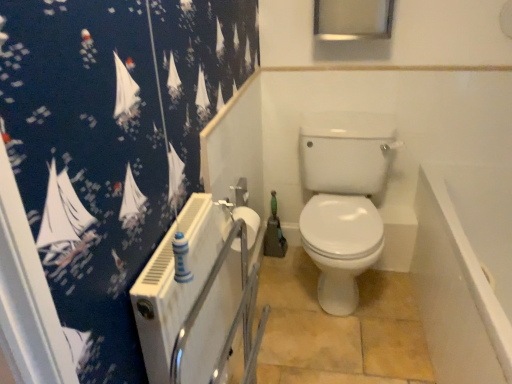
Question: Does white glossy bathtub at lower right appear on the right side of white matte toilet paper at center?

Choices:
 (A) no
 (B) yes

Answer: (B)

Question: Is white glossy bathtub at lower right outside white matte toilet paper at center?

Choices:
 (A) no
 (B) yes

Answer: (B)

Question: Is white glossy bathtub at lower right at the left side of white matte toilet paper at center?

Choices:
 (A) yes
 (B) no

Answer: (B)

Question: From the image's perspective, is white glossy bathtub at lower right over white matte toilet paper at center?

Choices:
 (A) no
 (B) yes

Answer: (A)

Question: From a real-world perspective, is white glossy bathtub at lower right beneath white matte toilet paper at center?

Choices:
 (A) no
 (B) yes

Answer: (B)

Question: Is white glossy bathtub at lower right wider or thinner than white matte toilet paper at center?

Choices:
 (A) wide
 (B) thin

Answer: (A)

Question: In terms of height, does white glossy bathtub at lower right look taller or shorter compared to white matte toilet paper at center?

Choices:
 (A) tall
 (B) short

Answer: (A)

Question: Considering the positions of white glossy bathtub at lower right and white matte toilet paper at center in the image, is white glossy bathtub at lower right bigger or smaller than white matte toilet paper at center?

Choices:
 (A) small
 (B) big

Answer: (B)

Question: Is white glossy bathtub at lower right inside the boundaries of white matte toilet paper at center, or outside?

Choices:
 (A) inside
 (B) outside

Answer: (B)

Question: Is white glossy toilet at center bigger or smaller than white glossy bathtub at lower right?

Choices:
 (A) big
 (B) small

Answer: (B)

Question: From a real-world perspective, relative to white glossy bathtub at lower right, is white glossy toilet at center vertically above or below?

Choices:
 (A) above
 (B) below

Answer: (A)

Question: Considering their positions, is white glossy toilet at center located in front of or behind white glossy bathtub at lower right?

Choices:
 (A) behind
 (B) front

Answer: (A)

Question: Looking at their shapes, would you say white glossy toilet at center is wider or thinner than white glossy bathtub at lower right?

Choices:
 (A) thin
 (B) wide

Answer: (B)

Question: Looking at the image, does white matte toilet paper at center seem bigger or smaller compared to white glossy toilet at center?

Choices:
 (A) big
 (B) small

Answer: (B)

Question: In terms of width, does white matte toilet paper at center look wider or thinner when compared to white glossy toilet at center?

Choices:
 (A) wide
 (B) thin

Answer: (B)